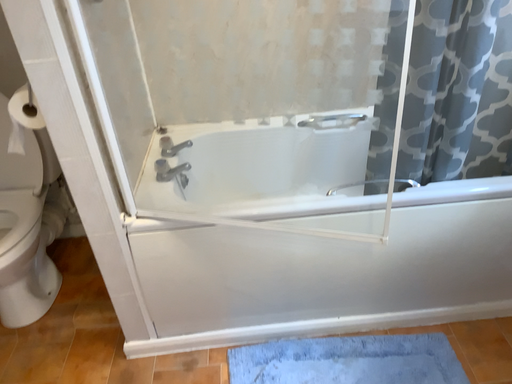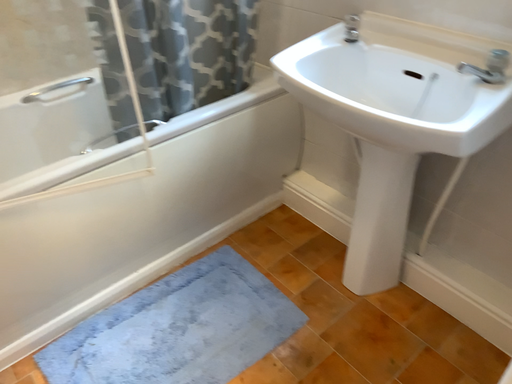
Question: Which way did the camera rotate in the video?

Choices:
 (A) rotated right
 (B) rotated left

Answer: (A)